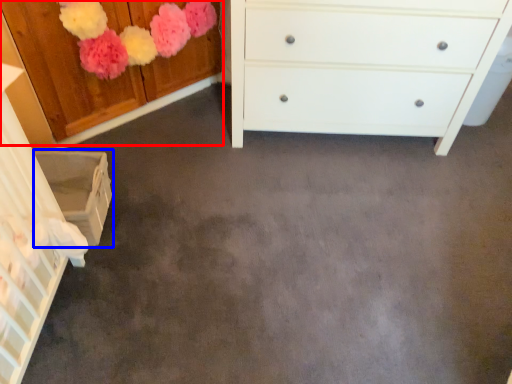
Question: Which object is further to the camera taking this photo, cabinetry (highlighted by a red box) or cabinetry (highlighted by a blue box)?

Choices:
 (A) cabinetry
 (B) cabinetry

Answer: (B)